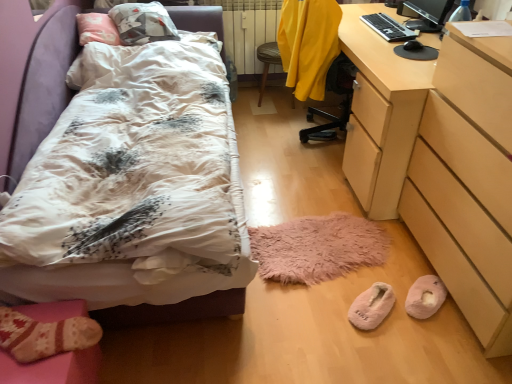
Where is `vacant space in front of black glossy monitor at upper right`? This screenshot has width=512, height=384. vacant space in front of black glossy monitor at upper right is located at coordinates (416, 37).